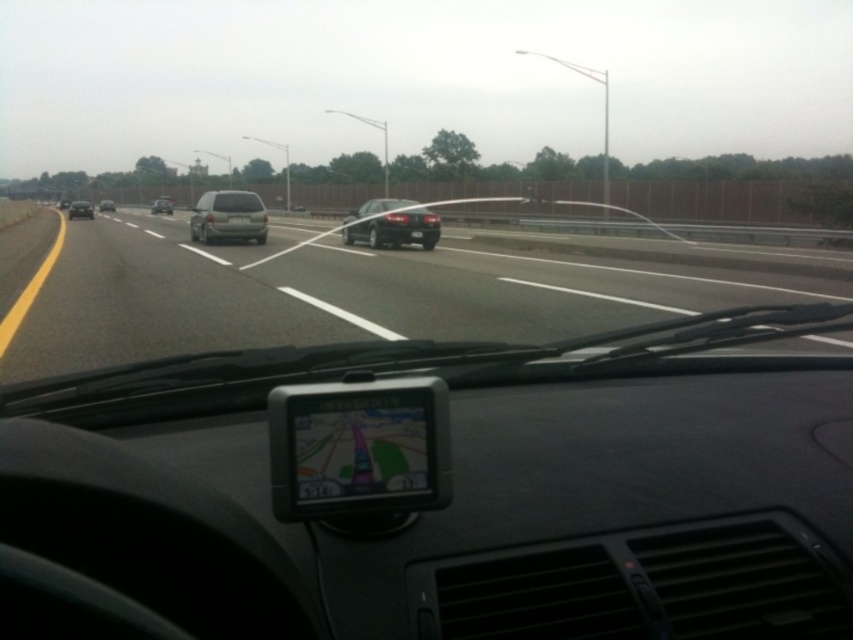
You are driving a car and see the satin silver suv at center and the silver metallic sedan at center ahead on the highway. Which vehicle is closer to your car?

The satin silver suv at center is closer to your car because it is positioned in front of the silver metallic sedan at center.

You are driving a car and see the matte gray car at center and the satin silver suv at center ahead on the highway. Your car is 14 feet long. Can you safely pass between them without changing lanes?

The matte gray car at center and the satin silver suv at center are 155.60 feet apart. Since your car is only 14 feet long, there is more than enough space to safely pass between them without changing lanes.

You are driving a car with a trunk length of 1.5 meters. You see the point at coordinates point (76, 208) on the highway ahead. Can your car safely pass through this point without hitting any obstacles?

The point at coordinates point (76, 208) is 50.49 meters away from the viewer. Since the car is 1.5 meters long, there is sufficient distance to safely pass through the point without hitting any obstacles.